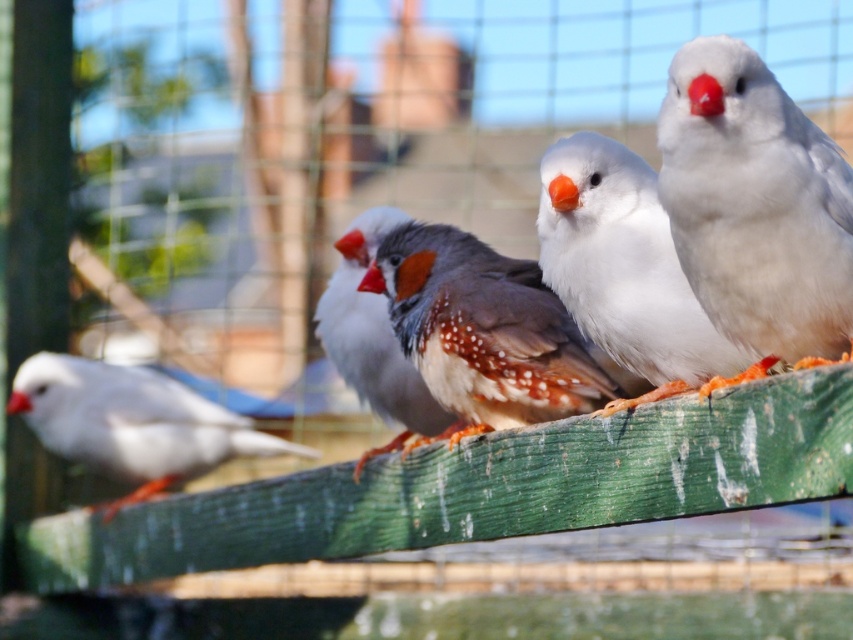
You are a birdwatcher observing the enclosure. You notice two birds, the white speckled bird at center and the white matte bird at left. Which one is taller?

The white speckled bird at center is taller than the white matte bird at left.

You are a photographer standing in front of the wooden structure with the birds. You want to take a closeup photo of the white matte bird at right. Given that your camera can focus on subjects within 5 feet, will you be able to take the photo without moving closer?

The white matte bird at right is 5.14 feet away from the camera, which is slightly beyond the camera focus range of 5 feet. Therefore, you will need to move closer to take the closeup photo.